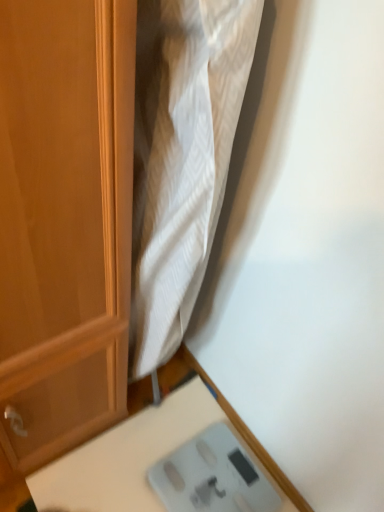
Identify the location of free space underneath white plastic scale at lower right (from a real-world perspective). (185, 473).